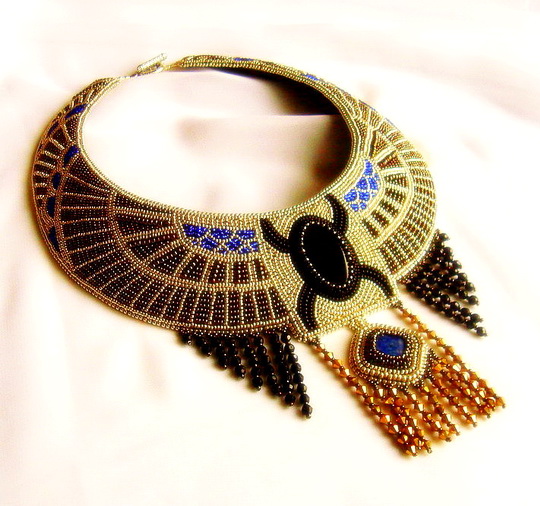
The width and height of the screenshot is (540, 506). I want to click on pink satin cloth, so click(x=226, y=168).